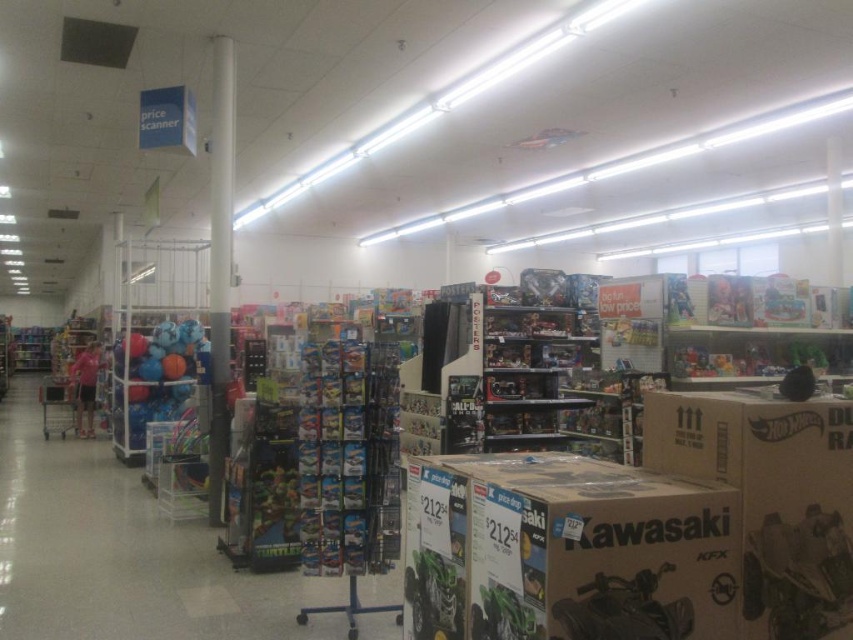
You are a customer in the toy store and want to pick up the matte blue basketball at left and the pink fabric shirt at center. Which item should you reach for first if you want to grab the one that is higher up?

The matte blue basketball at left is located above the pink fabric shirt at center, so you should reach for the matte blue basketball at left first.

You are a store employee who needs to retrieve the pink fabric shirt at center from the shelf. However, the white cardboard hot wheels box at right is blocking the way. Can you remove the box to access the shirt?

The white cardboard hot wheels box at right is positioned over the pink fabric shirt at center, so you can remove the box to access the shirt.

You are a store employee who needs to place a new price tag between the white cardboard hot wheels box at right and the pink fabric shirt at center. The price scanner sign is hanging above the shelf where you are working. How far apart should you place the two items to ensure the scanner can read both from its position?

The white cardboard hot wheels box at right and pink fabric shirt at center are 34.76 feet apart. To ensure the price scanner can read both, they should be placed approximately 34.76 feet apart as they currently are.